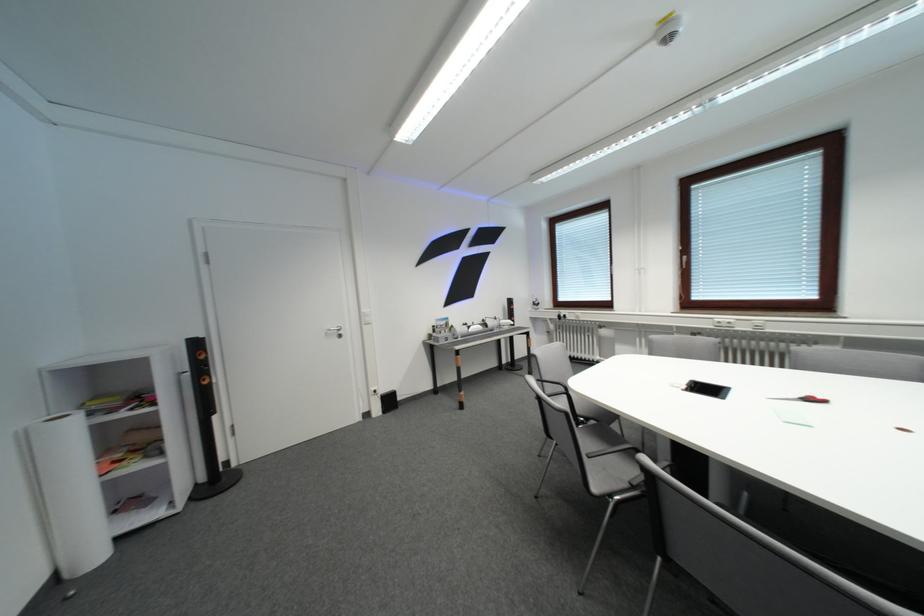
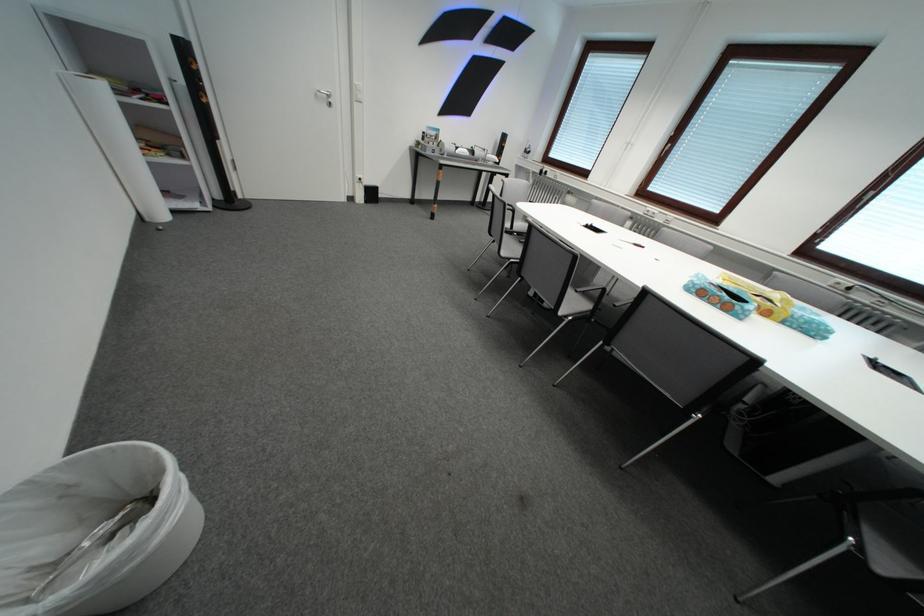
Locate, in the second image, the point that corresponds to the point at 621,498 in the first image.

(519, 262)